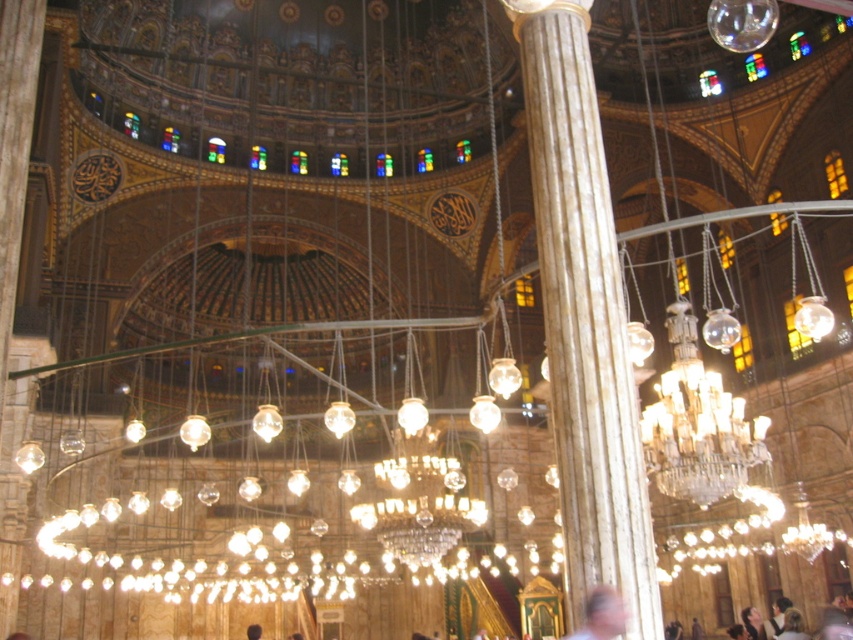
Question: Is blonde hair at center to the right of dark brown hair at center from the viewer's perspective?

Choices:
 (A) yes
 (B) no

Answer: (A)

Question: Estimate the real-world distances between objects in this image. Which object is farther from the dark brown hair at center?

Choices:
 (A) smooth skin face at lower right
 (B) blurred skin at center
 (C) blonde hair at center

Answer: (B)

Question: Among these objects, which one is farthest from the camera?

Choices:
 (A) blonde hair at center
 (B) blurred skin at center
 (C) white marble column at center

Answer: (A)

Question: Is white marble column at center smaller than dark brown hair at center?

Choices:
 (A) yes
 (B) no

Answer: (A)

Question: Among these objects, which one is farthest from the camera?

Choices:
 (A) blurred skin at center
 (B) smooth skin face at lower right
 (C) blonde hair at center

Answer: (B)

Question: Can you confirm if blurred skin at center is positioned to the right of blonde hair at center?

Choices:
 (A) yes
 (B) no

Answer: (B)